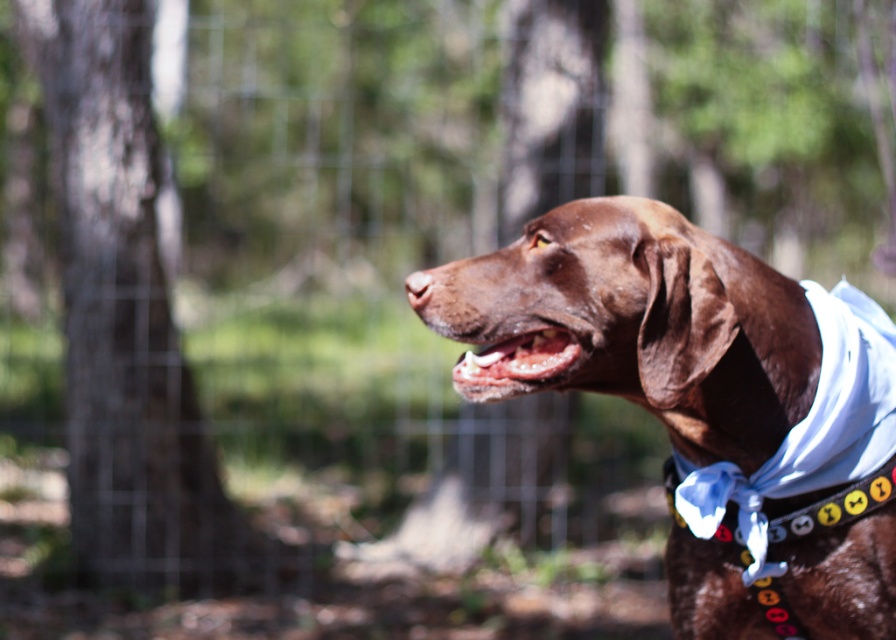
Question: Does brown bark tree at left appear on the left side of pink glossy teeth at center?

Choices:
 (A) no
 (B) yes

Answer: (B)

Question: Can you confirm if brown fur dog at center is positioned below pink glossy teeth at center?

Choices:
 (A) no
 (B) yes

Answer: (B)

Question: Among these points, which one is nearest to the camera?

Choices:
 (A) (850, 368)
 (B) (530, 260)
 (C) (58, 109)

Answer: (B)

Question: Which of the following is the farthest from the observer?

Choices:
 (A) (892, 401)
 (B) (132, 192)
 (C) (565, 344)

Answer: (B)

Question: Is brown fur dog at center to the left of brown bark tree at left from the viewer's perspective?

Choices:
 (A) yes
 (B) no

Answer: (B)

Question: Which point is closer to the camera taking this photo?

Choices:
 (A) (847, 465)
 (B) (459, 378)
 (C) (490, 316)
 (D) (157, 244)

Answer: (B)